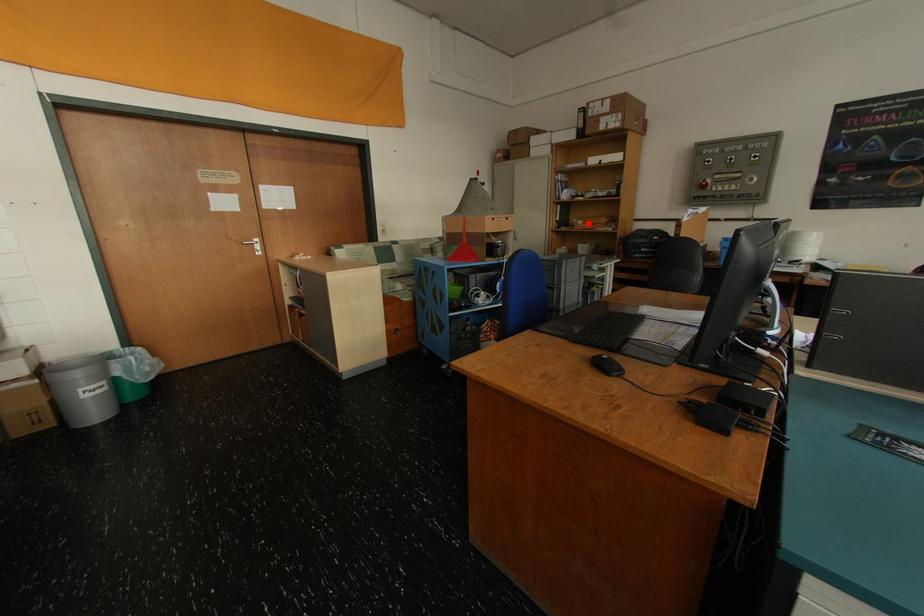
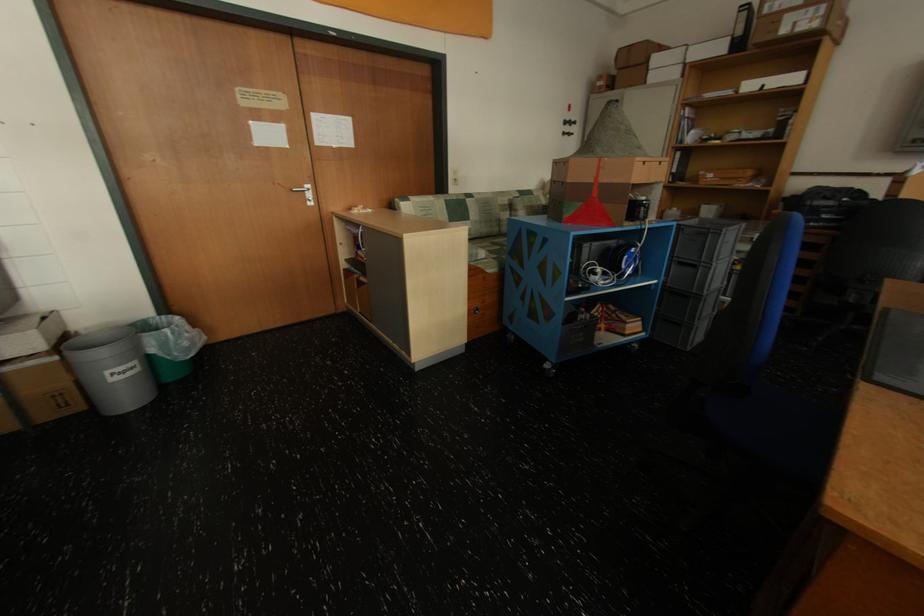
Where in the second image is the point corresponding to the highlighted location from the first image?

(719, 177)